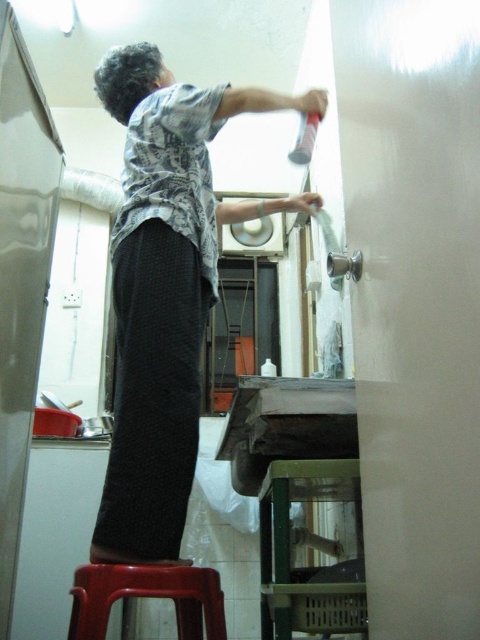
Where is the gray cotton shirt at upper center located in the image?

The gray cotton shirt at upper center is located at point (166, 289) in the image.

What is the color of the shirt worn by the person at the point marked by coordinates (166,289)?

The gray cotton shirt at upper center is located at point (166,289), so the color is gray.

Based on the photo, you are trying to reach a high shelf in the kitchen. You have a gray cotton shirt at upper center and a plastic stool at lower left. Which item is closer to the high shelf?

The gray cotton shirt at upper center is closer to the high shelf because it is only 42.49 centimeters away from the plastic stool at lower left, but this distance does not directly indicate proximity to the shelf. However, since the shirt is at upper center and the stool is at lower left, the shirt is positioned higher and thus closer to the high shelf.